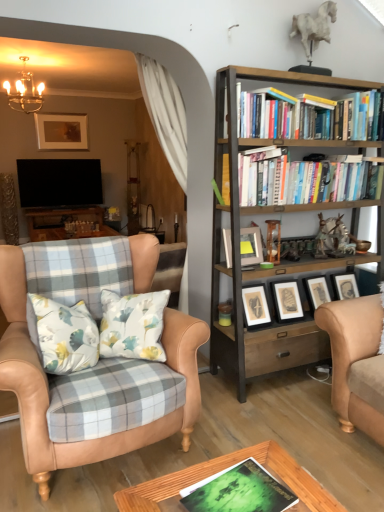
Question: From a real-world perspective, is hardcover books at upper right, the second book in the left-to-right sequence, on green matte book at center, the 2th book positioned from the back?

Choices:
 (A) no
 (B) yes

Answer: (B)

Question: Is hardcover books at upper right, the second book in the left-to-right sequence, bigger than green matte book at center, placed as the second book when sorted from right to left?

Choices:
 (A) no
 (B) yes

Answer: (B)

Question: Considering the relative sizes of hardcover books at upper right, which is the second book from bottom to top, and green matte book at center, the 2th book from the top, in the image provided, is hardcover books at upper right, which is the second book from bottom to top, wider than green matte book at center, the 2th book from the top,?

Choices:
 (A) yes
 (B) no

Answer: (B)

Question: From the image's perspective, is hardcover books at upper right, placed as the first book when sorted from right to left, located beneath green matte book at center, placed as the second book when sorted from right to left?

Choices:
 (A) yes
 (B) no

Answer: (B)

Question: Can you confirm if hardcover books at upper right, which is the second book from bottom to top, is shorter than green matte book at center, which is counted as the first book, starting from the front?

Choices:
 (A) no
 (B) yes

Answer: (A)

Question: Is tan leather chair at left in front of or behind green matte book at center, marked as the 1th book in a left-to-right arrangement, in the image?

Choices:
 (A) front
 (B) behind

Answer: (B)

Question: From a real-world perspective, is tan leather chair at left physically located above or below green matte book at center, which is the 1th book in bottom-to-top order?

Choices:
 (A) below
 (B) above

Answer: (B)

Question: Is point (132, 442) closer or farther from the camera than point (258, 504)?

Choices:
 (A) closer
 (B) farther

Answer: (B)

Question: Looking at their shapes, would you say tan leather chair at left is wider or thinner than green matte book at center, the 2th book from the top?

Choices:
 (A) wide
 (B) thin

Answer: (A)

Question: Considering the positions of point (248, 240) and point (26, 95), is point (248, 240) closer or farther from the camera than point (26, 95)?

Choices:
 (A) closer
 (B) farther

Answer: (A)

Question: Considering the positions of matte gray picture frame at center, which is the 1th picture frame from right to left, and metallic chandelier at upper left in the image, is matte gray picture frame at center, which is the 1th picture frame from right to left, bigger or smaller than metallic chandelier at upper left?

Choices:
 (A) small
 (B) big

Answer: (A)

Question: From the image's perspective, is matte gray picture frame at center, the second picture frame in the top-to-bottom sequence, located above or below metallic chandelier at upper left?

Choices:
 (A) above
 (B) below

Answer: (B)

Question: From a real-world perspective, is matte gray picture frame at center, which is the 1th picture frame in bottom-to-top order, physically located above or below metallic chandelier at upper left?

Choices:
 (A) above
 (B) below

Answer: (B)

Question: Which is correct: metallic chandelier at upper left is inside hardcover books at upper right, which is the second book from bottom to top, or outside of it?

Choices:
 (A) outside
 (B) inside

Answer: (A)

Question: From a real-world perspective, relative to hardcover books at upper right, which is the second book from bottom to top, is metallic chandelier at upper left vertically above or below?

Choices:
 (A) above
 (B) below

Answer: (A)